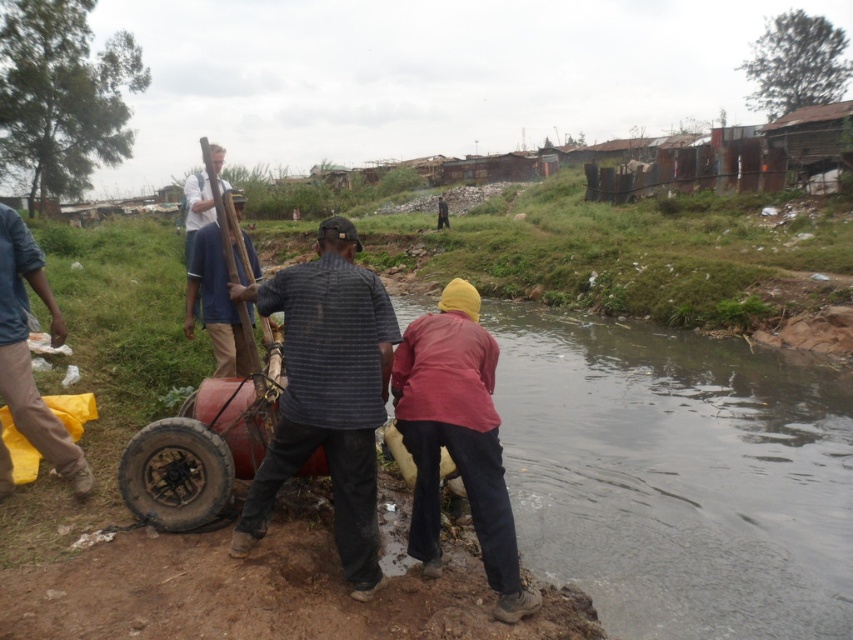
Between striped cotton shirt at center and dirty rubber tire at lower left, which one is positioned lower?

dirty rubber tire at lower left

In the scene shown: Does striped cotton shirt at center come behind dirty rubber tire at lower left?

No, it is in front of dirty rubber tire at lower left.

This screenshot has height=640, width=853. I want to click on striped cotton shirt at center, so [x=328, y=394].

Which is in front, point (225, 298) or point (194, 177)?

Point (225, 298) is more forward.

How far apart are blue fabric shirt at center and white matte shirt at upper center?

1.33 meters

You are a GUI agent. You are given a task and a screenshot of the screen. Output one action in this format:
    pyautogui.click(x=<x>, y=<y>)
    Task: Click on the blue fabric shirt at center
    The height and width of the screenshot is (640, 853).
    Given the screenshot: What is the action you would take?
    pyautogui.click(x=215, y=301)

Based on the photo, can you confirm if dirty rubber tire at lower left is positioned above white matte shirt at upper center?

No.

Can you confirm if dirty rubber tire at lower left is positioned below white matte shirt at upper center?

Yes, dirty rubber tire at lower left is below white matte shirt at upper center.

This screenshot has height=640, width=853. Describe the element at coordinates (175, 474) in the screenshot. I see `dirty rubber tire at lower left` at that location.

This screenshot has width=853, height=640. I want to click on dirty rubber tire at lower left, so click(175, 474).